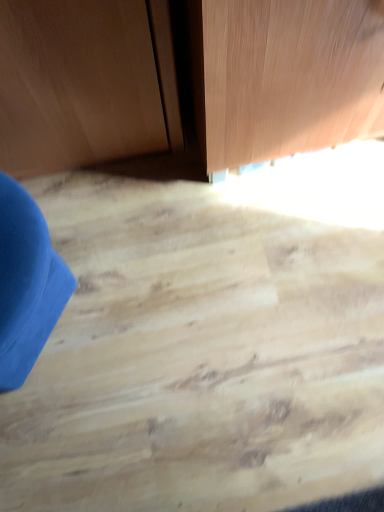
Locate an element on the screen. The height and width of the screenshot is (512, 384). natural wood door at upper center is located at coordinates (290, 76).

What do you see at coordinates (290, 76) in the screenshot?
I see `natural wood door at upper center` at bounding box center [290, 76].

Locate an element on the screen. natural wood door at upper center is located at coordinates (290, 76).